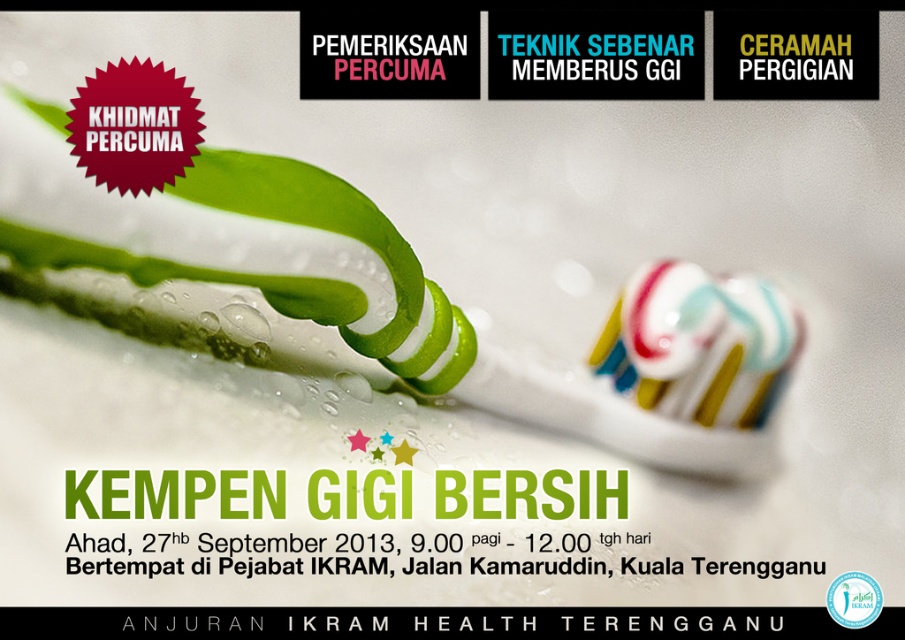
Question: Can you confirm if green striped toothbrush at upper left is positioned to the right of multicolored striped toothpaste at center?

Choices:
 (A) no
 (B) yes

Answer: (A)

Question: Among these points, which one is farthest from the camera?

Choices:
 (A) (722, 410)
 (B) (565, 413)

Answer: (A)

Question: Which point appears closest to the camera in this image?

Choices:
 (A) pos(741,416)
 (B) pos(667,360)

Answer: (B)

Question: Among these objects, which one is nearest to the camera?

Choices:
 (A) green striped toothbrush at upper left
 (B) multicolored striped toothpaste at center

Answer: (A)

Question: Is green striped toothbrush at upper left above multicolored striped toothpaste at center?

Choices:
 (A) yes
 (B) no

Answer: (A)

Question: Can you confirm if green striped toothbrush at upper left is bigger than multicolored striped toothpaste at center?

Choices:
 (A) yes
 (B) no

Answer: (A)